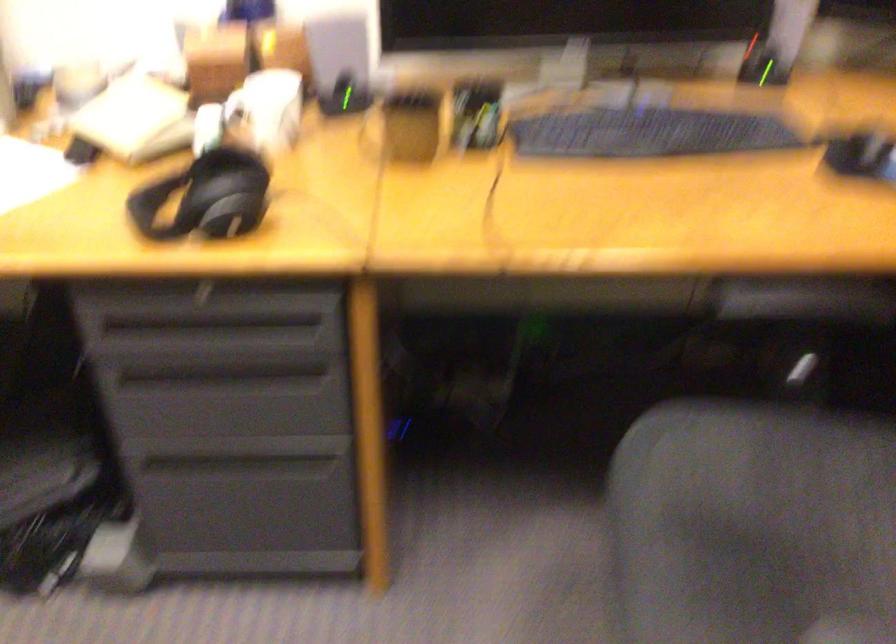
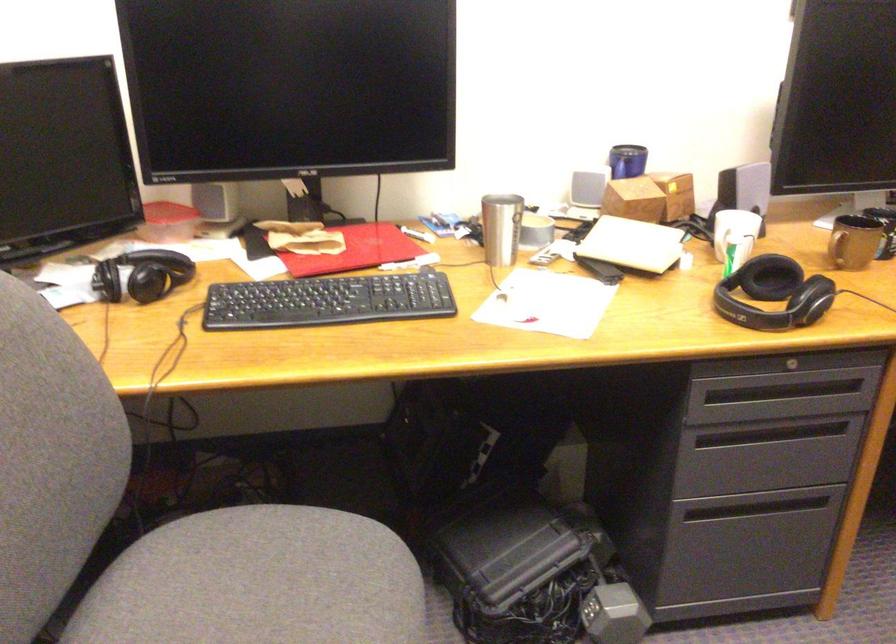
The point at (106, 561) is marked in the first image. Where is the corresponding point in the second image?

(614, 614)